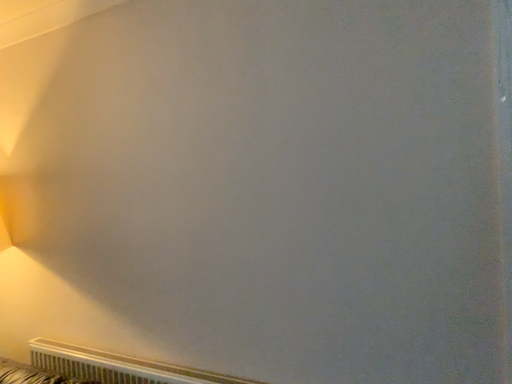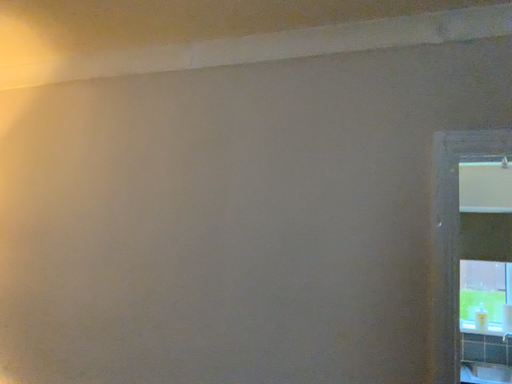
Question: Which way did the camera rotate in the video?

Choices:
 (A) rotated upward
 (B) rotated downward

Answer: (A)